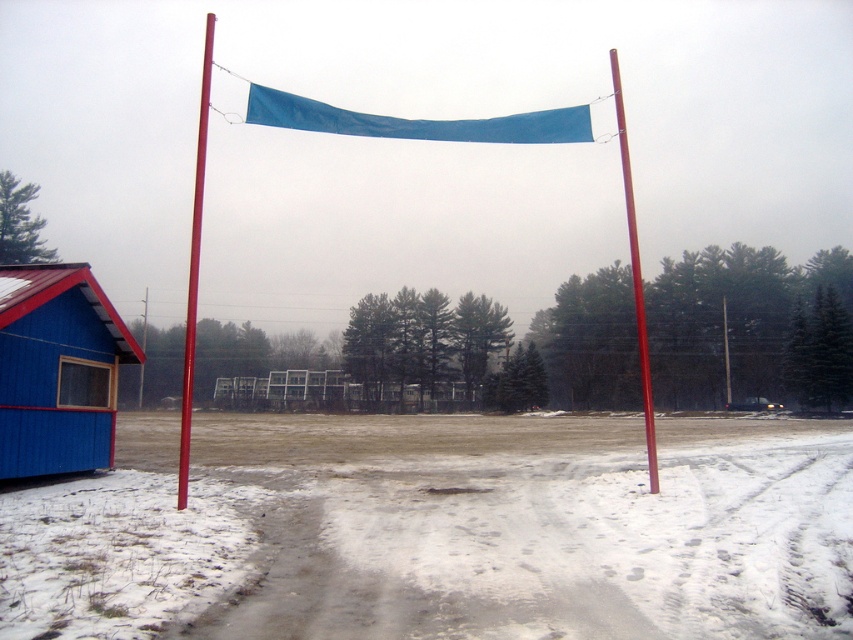
Question: Can you confirm if blue fabric flag at center is positioned below smooth red pole at left?

Choices:
 (A) yes
 (B) no

Answer: (B)

Question: Is blue wood hut at lower left positioned before smooth red pole at left?

Choices:
 (A) yes
 (B) no

Answer: (B)

Question: Can you confirm if gray compacted dirt at center is bigger than smooth red pole at left?

Choices:
 (A) no
 (B) yes

Answer: (A)

Question: Estimate the real-world distances between objects in this image. Which object is farther from the blue wood hut at lower left?

Choices:
 (A) smooth red pole at right
 (B) gray compacted dirt at center

Answer: (A)

Question: Which point appears closest to the camera in this image?

Choices:
 (A) (300, 112)
 (B) (647, 467)
 (C) (183, 426)
 (D) (770, 493)

Answer: (C)

Question: Which object is farther from the camera taking this photo?

Choices:
 (A) smooth red pole at right
 (B) gray compacted dirt at center

Answer: (A)